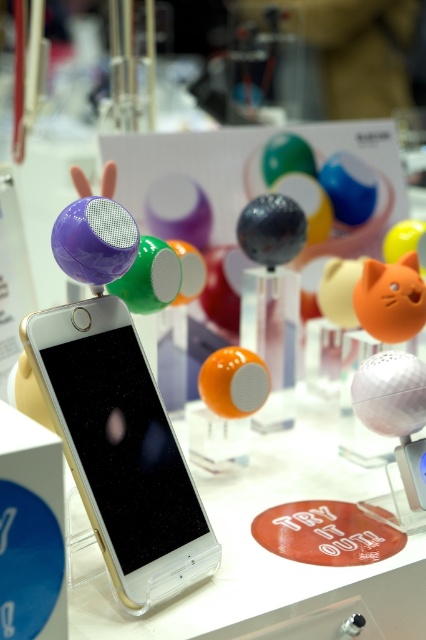
Does silver metallic phone at center have a greater height compared to orange matte cat-shaped object at center?

Yes, silver metallic phone at center is taller than orange matte cat-shaped object at center.

Does silver metallic phone at center appear on the left side of orange matte cat-shaped object at center?

A: Yes, silver metallic phone at center is to the left of orange matte cat-shaped object at center.

Is point (117, 368) positioned behind point (383, 324)?

That is False.

Where is `silver metallic phone at center`? The height and width of the screenshot is (640, 426). silver metallic phone at center is located at coordinates (120, 449).